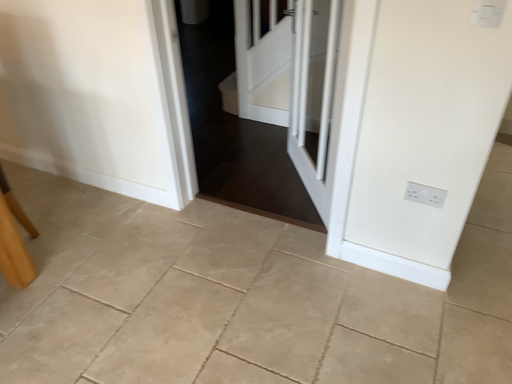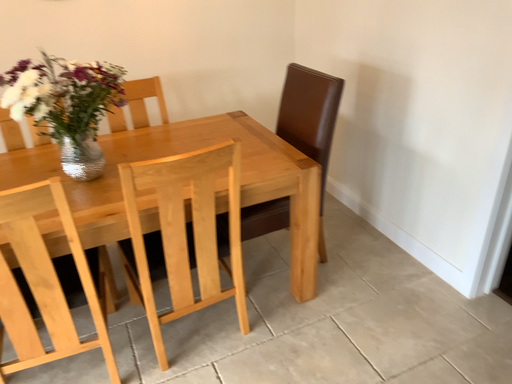
Question: Which way did the camera rotate in the video?

Choices:
 (A) rotated left
 (B) rotated right

Answer: (A)